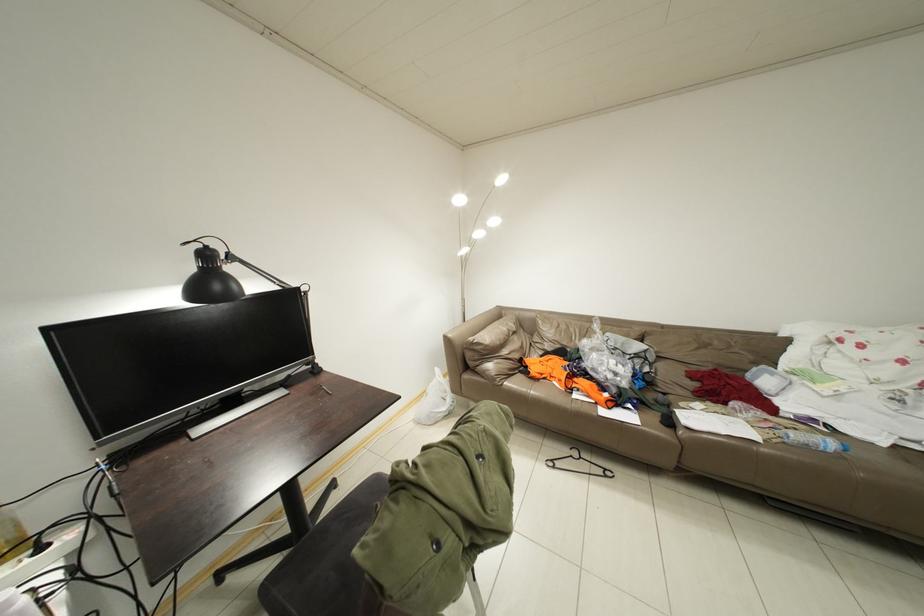
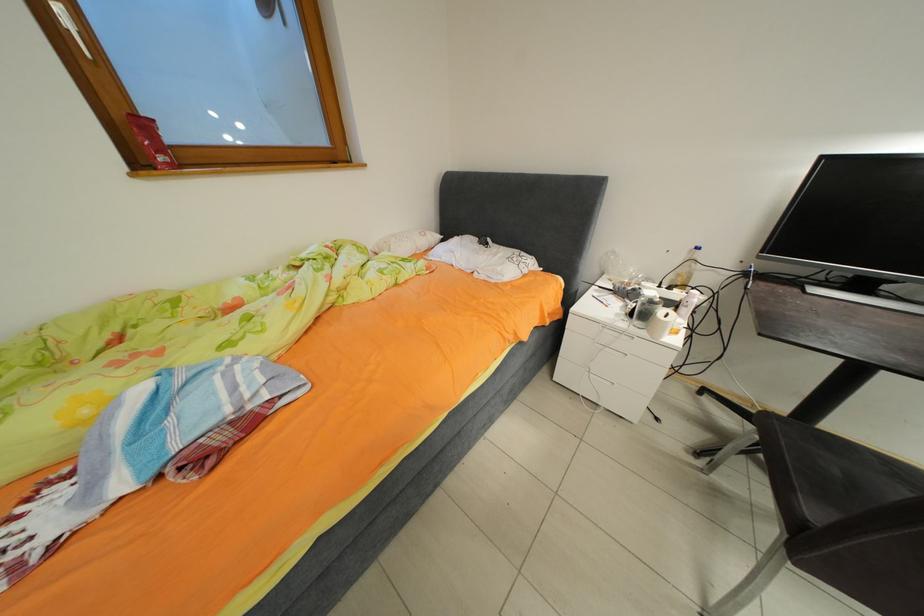
First-person continuous shooting, in which direction is the camera rotating?

The camera rotated toward left-down.